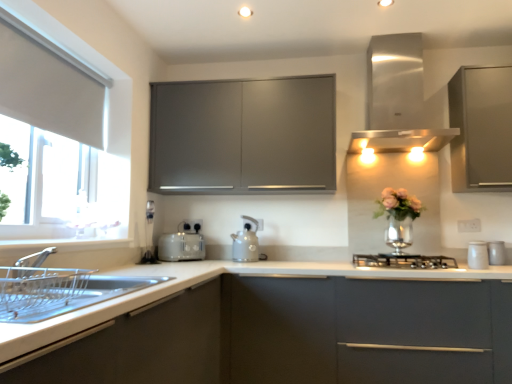
Question: Should I look upward or downward to see black matte gas stove at center?

Choices:
 (A) down
 (B) up

Answer: (A)

Question: Is white fabric at left facing towards matte gray kettle at center?

Choices:
 (A) no
 (B) yes

Answer: (A)

Question: Is white fabric at left shorter than matte gray kettle at center?

Choices:
 (A) no
 (B) yes

Answer: (A)

Question: Is white fabric at left to the right of matte gray kettle at center from the viewer's perspective?

Choices:
 (A) no
 (B) yes

Answer: (A)

Question: Can matte gray kettle at center be found inside white fabric at left?

Choices:
 (A) no
 (B) yes

Answer: (A)

Question: Is white fabric at left looking in the opposite direction of matte gray kettle at center?

Choices:
 (A) no
 (B) yes

Answer: (A)

Question: Is white fabric at left positioned far away from matte gray kettle at center?

Choices:
 (A) no
 (B) yes

Answer: (B)

Question: Could you tell me if stainless steel vent at upper right is facing white fabric at left?

Choices:
 (A) yes
 (B) no

Answer: (B)

Question: Is stainless steel vent at upper right oriented away from white fabric at left?

Choices:
 (A) no
 (B) yes

Answer: (A)

Question: Does stainless steel vent at upper right touch white fabric at left?

Choices:
 (A) yes
 (B) no

Answer: (B)

Question: Considering the relative sizes of stainless steel vent at upper right and white fabric at left in the image provided, is stainless steel vent at upper right smaller than white fabric at left?

Choices:
 (A) no
 (B) yes

Answer: (A)

Question: Is stainless steel vent at upper right to the right of white fabric at left from the viewer's perspective?

Choices:
 (A) yes
 (B) no

Answer: (A)

Question: Does stainless steel vent at upper right appear on the left side of white fabric at left?

Choices:
 (A) yes
 (B) no

Answer: (B)

Question: Is white matte countertop at center taller than matte gray cabinet at center, which is the second cabinetry in right-to-left order?

Choices:
 (A) yes
 (B) no

Answer: (A)